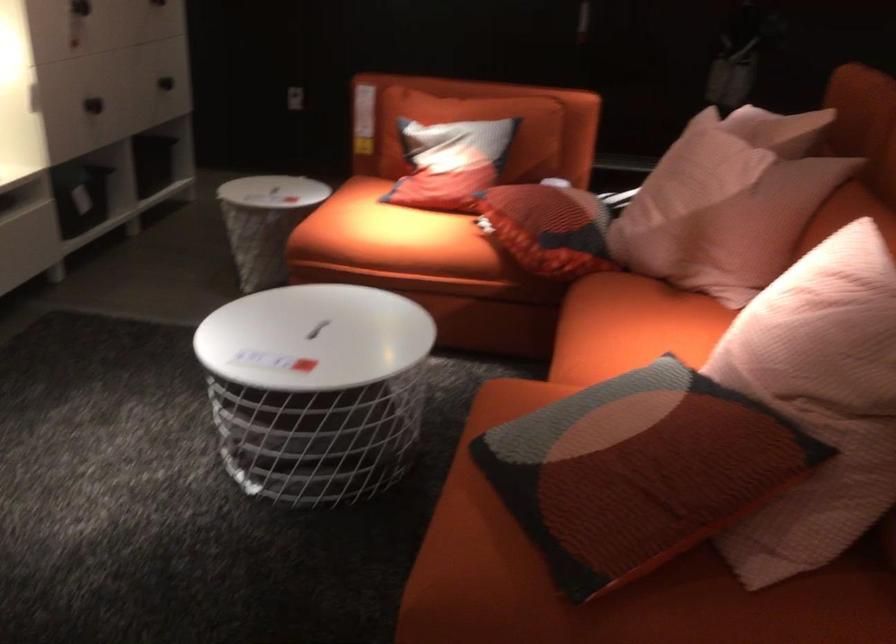
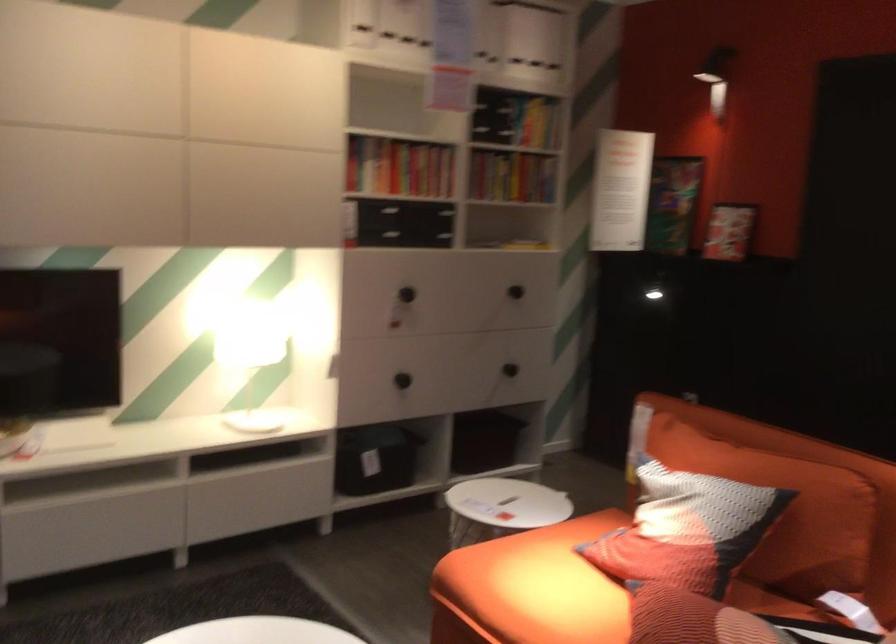
Find the pixel in the second image that matches point (528, 131) in the first image.

(785, 511)